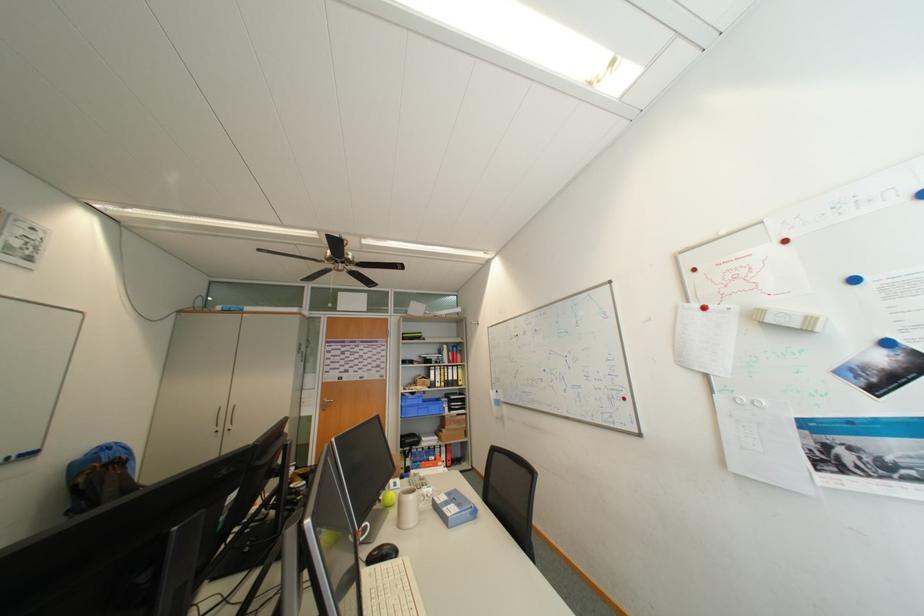
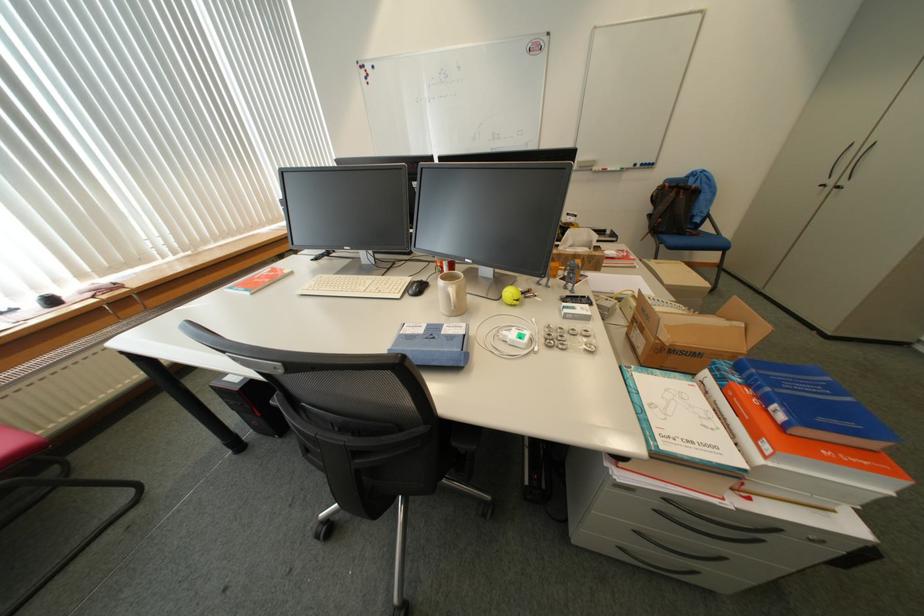
Find the pixel in the second image that matches the point at 450,464 in the first image.

(775, 448)